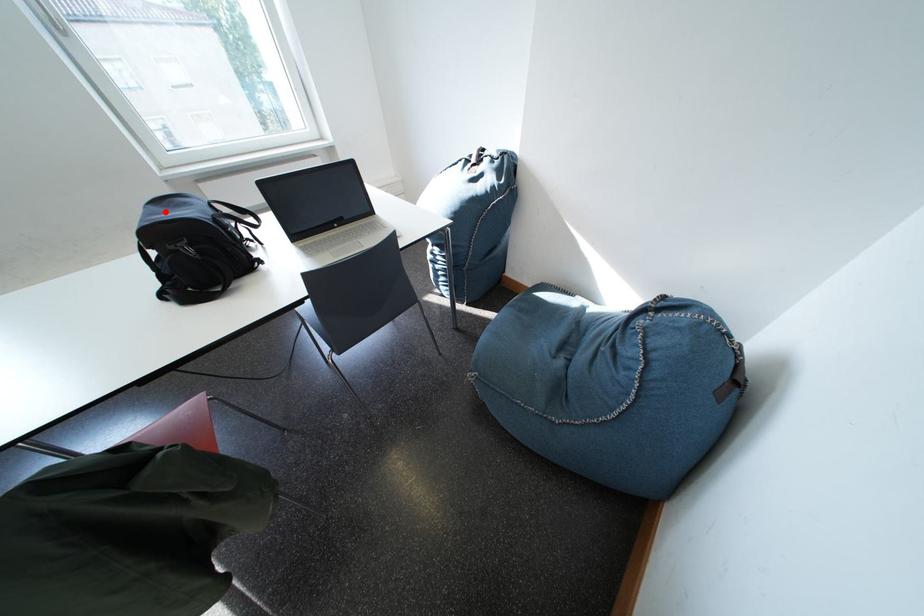
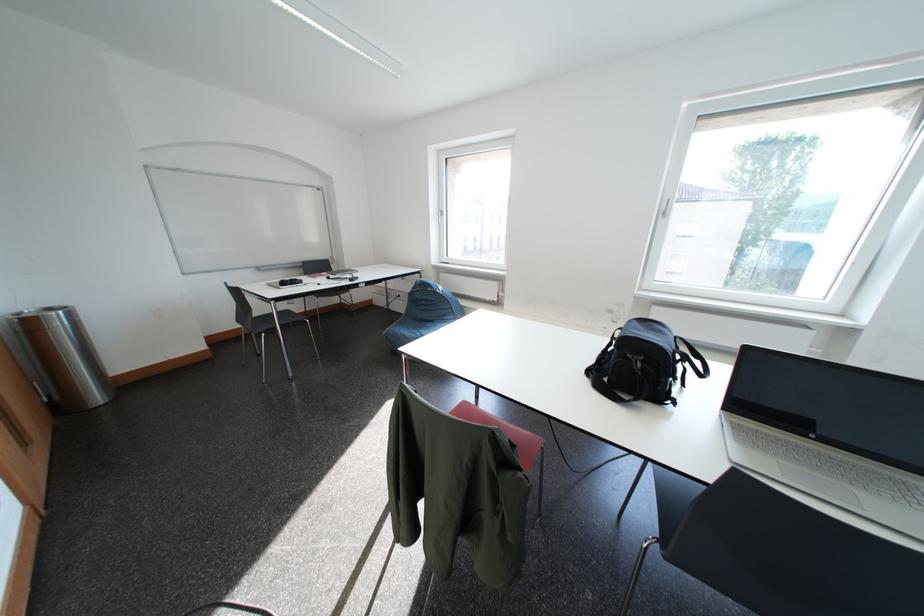
Locate, in the second image, the point that corresponds to the highlighted location in the first image.

(648, 326)